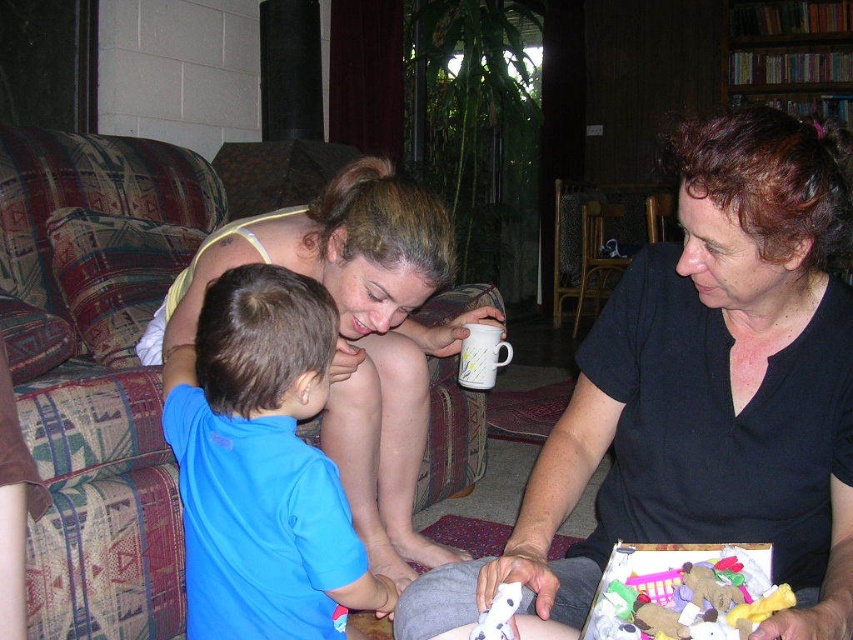
Which is above, soft plush toys at lower right or gray fabric at lower center?

Positioned higher is soft plush toys at lower right.

Between soft plush toys at lower right and gray fabric at lower center, which one appears on the left side from the viewer's perspective?

Positioned to the left is gray fabric at lower center.

Describe the element at coordinates (683, 593) in the screenshot. The image size is (853, 640). I see `soft plush toys at lower right` at that location.

Where is `soft plush toys at lower right`? The height and width of the screenshot is (640, 853). soft plush toys at lower right is located at coordinates (683, 593).

Who is positioned more to the right, gray fabric at lower center or white ceramic mug at center?

From the viewer's perspective, gray fabric at lower center appears more on the right side.

Does gray fabric at lower center have a lesser width compared to white ceramic mug at center?

No.

Which is behind, point (550, 566) or point (469, 339)?

Positioned behind is point (469, 339).

Identify the location of gray fabric at lower center. (438, 600).

Is matte black shirt at center bigger than white ceramic mug at center?

Yes.

Is matte black shirt at center behind white ceramic mug at center?

No, matte black shirt at center is in front of white ceramic mug at center.

Describe the element at coordinates (355, 336) in the screenshot. This screenshot has height=640, width=853. I see `matte black shirt at center` at that location.

The width and height of the screenshot is (853, 640). What are the coordinates of `matte black shirt at center` in the screenshot? It's located at (355, 336).